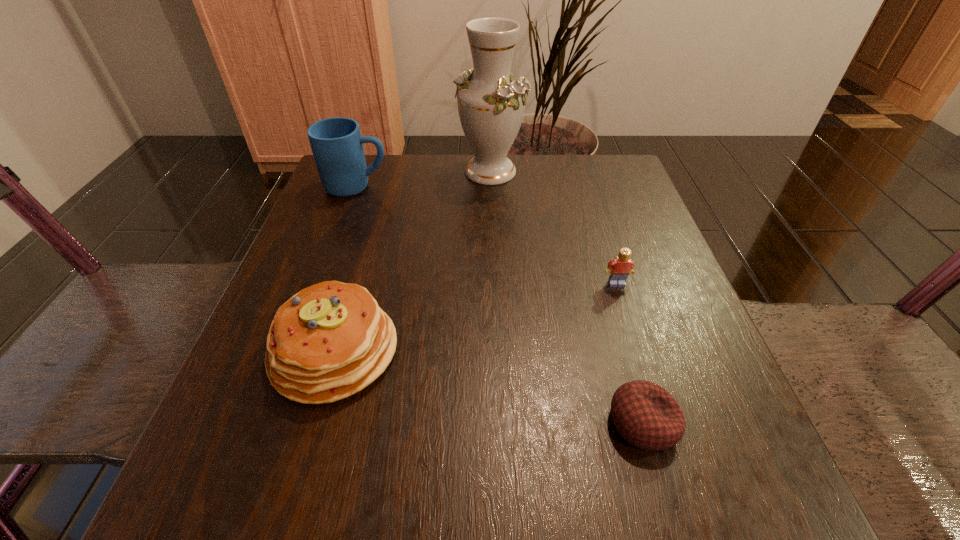
This screenshot has height=540, width=960. Identify the location of free region located on the front-facing side of the Lego. (639, 355).

Locate an element on the screen. The width and height of the screenshot is (960, 540). free space located 0.350m on the left of the shortest object is located at coordinates (356, 422).

Identify the location of vase positioned at the far edge. The image size is (960, 540). (491, 104).

Locate an element on the screen. The image size is (960, 540). mug that is at the far edge is located at coordinates (337, 145).

The height and width of the screenshot is (540, 960). Find the location of `object positioned at the near edge`. object positioned at the near edge is located at coordinates (645, 414).

This screenshot has height=540, width=960. I want to click on mug that is at the left edge, so click(337, 145).

Locate an element on the screen. The width and height of the screenshot is (960, 540). pancake at the left edge is located at coordinates (329, 341).

Identify the location of Lego located in the right edge section of the desktop. (619, 268).

The image size is (960, 540). I want to click on beanbag that is positioned at the right edge, so click(x=645, y=414).

At what (x,y) coordinates should I click in order to perform the action: click on object that is positioned at the far left corner. Please return your answer as a coordinate pair (x, y). This screenshot has width=960, height=540. Looking at the image, I should click on (337, 145).